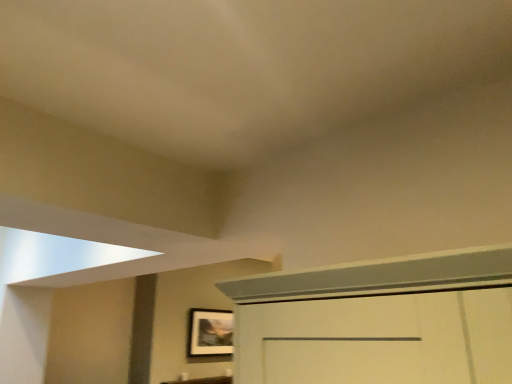
The image size is (512, 384). I want to click on matte black picture frame at center, so click(210, 332).

Image resolution: width=512 pixels, height=384 pixels. What do you see at coordinates (210, 332) in the screenshot?
I see `matte black picture frame at center` at bounding box center [210, 332].

Locate an element on the screen. The width and height of the screenshot is (512, 384). matte black picture frame at center is located at coordinates (210, 332).